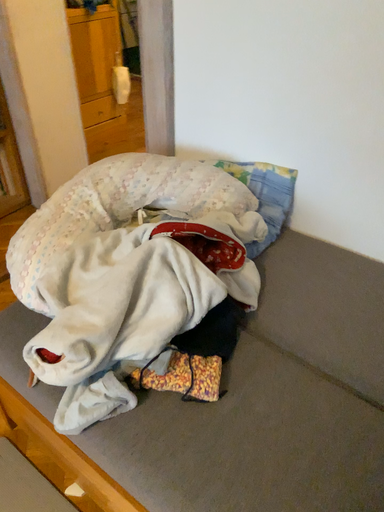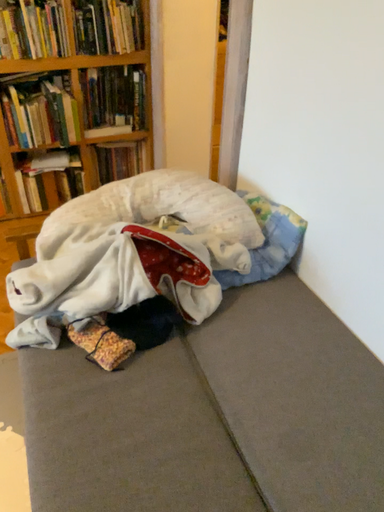
Question: How did the camera likely rotate when shooting the video?

Choices:
 (A) rotated downward
 (B) rotated upward

Answer: (B)